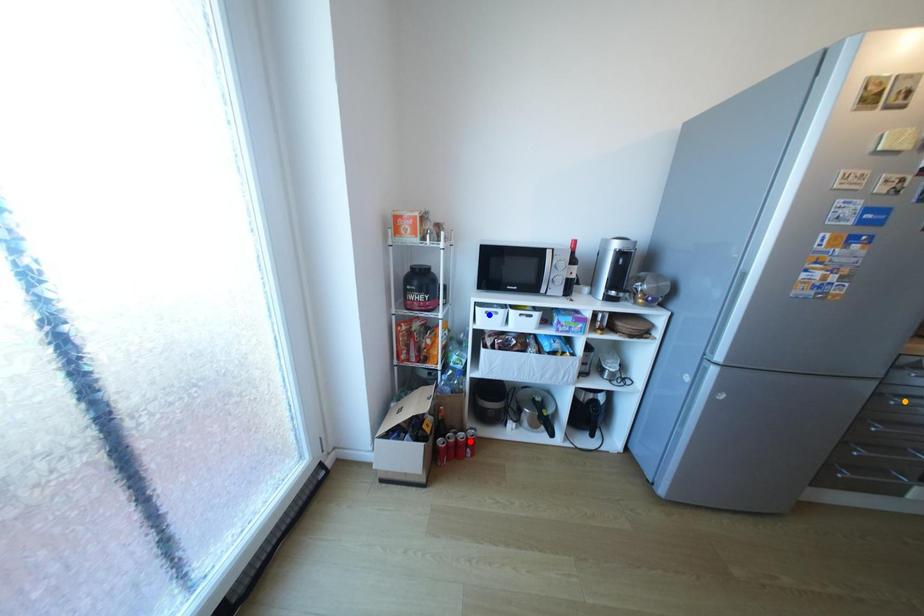
Order these from farthest to nearest:
red point, orange point, blue point

red point < blue point < orange point